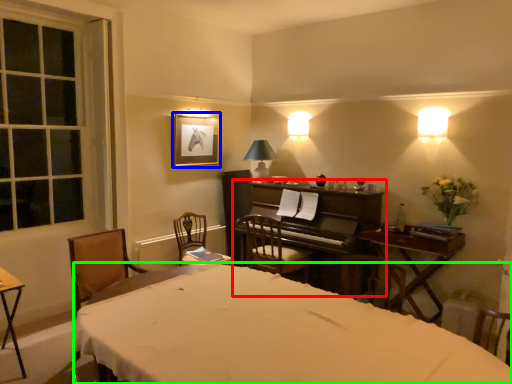
Question: Based on their relative distances, which object is farther from piano (highlighted by a red box)? Choose from picture frame (highlighted by a blue box) and bed (highlighted by a green box).

Choices:
 (A) picture frame
 (B) bed

Answer: (B)